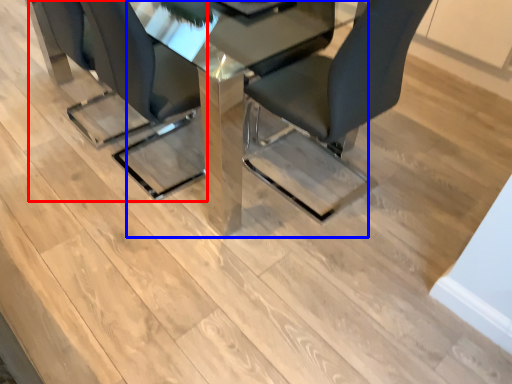
Question: Among these objects, which one is farthest to the camera, chair (highlighted by a red box) or table (highlighted by a blue box)?

Choices:
 (A) chair
 (B) table

Answer: (A)